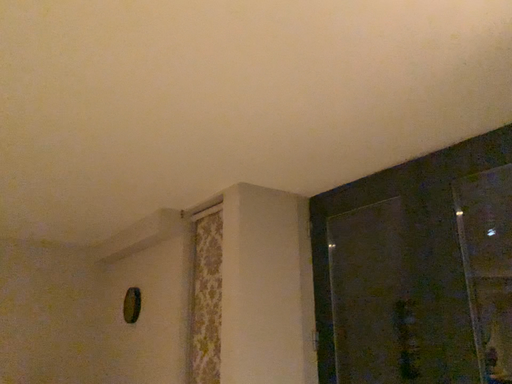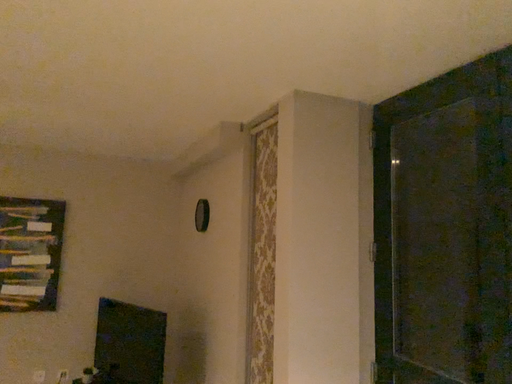
Question: Which way did the camera rotate in the video?

Choices:
 (A) rotated upward
 (B) rotated downward

Answer: (B)